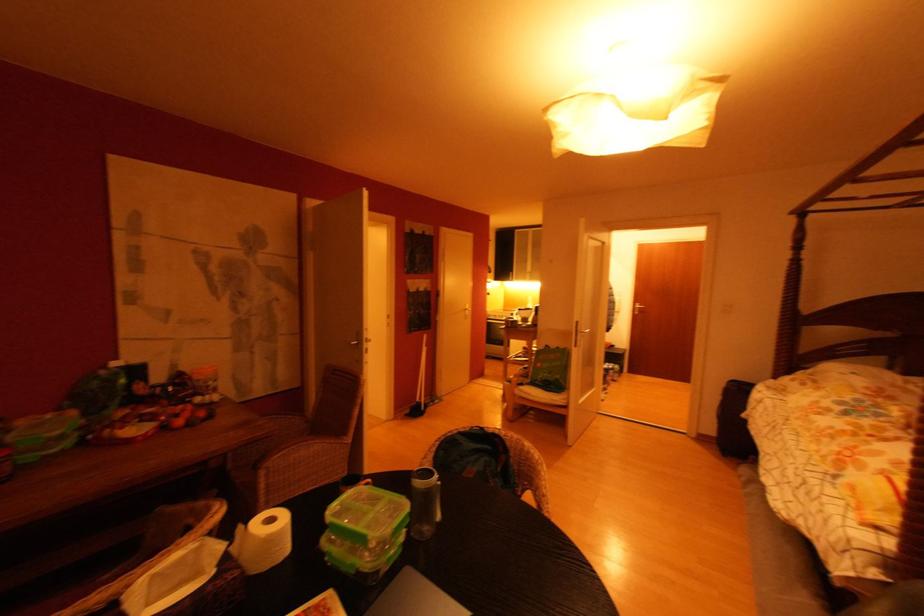
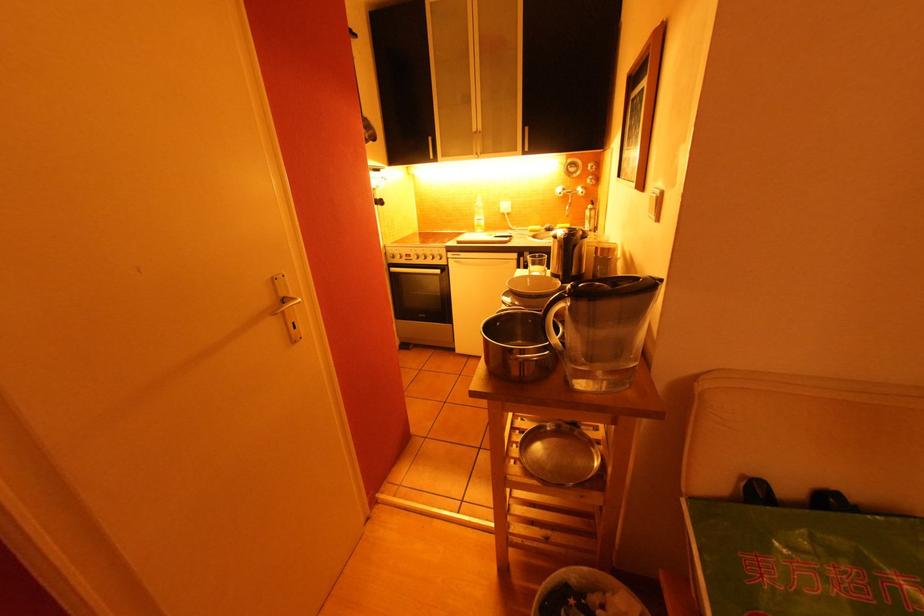
In the second image, find the point that corresponds to the point at 533,302 in the first image.

(481, 211)